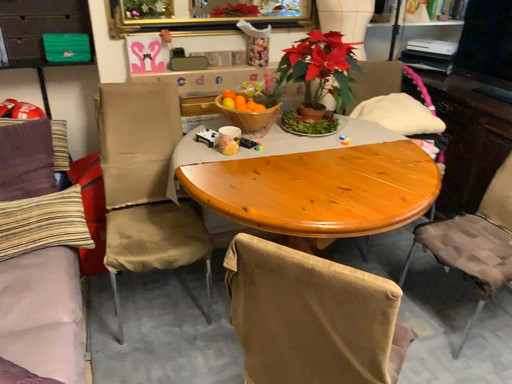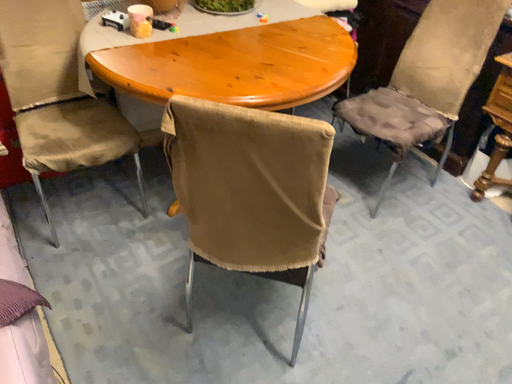
Question: How did the camera likely rotate when shooting the video?

Choices:
 (A) rotated downward
 (B) rotated upward

Answer: (A)